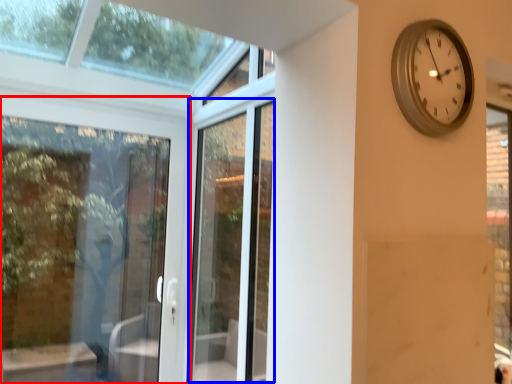
Question: Which object appears closest to the camera in this image, door (highlighted by a red box) or screen door (highlighted by a blue box)?

Choices:
 (A) door
 (B) screen door

Answer: (B)